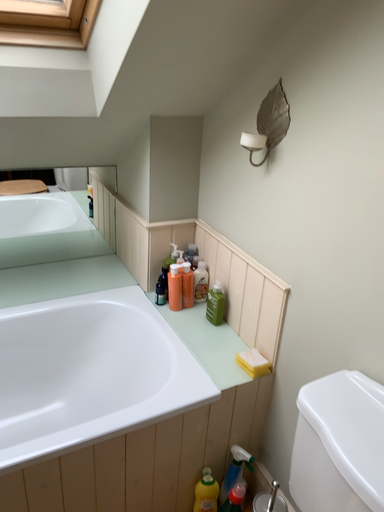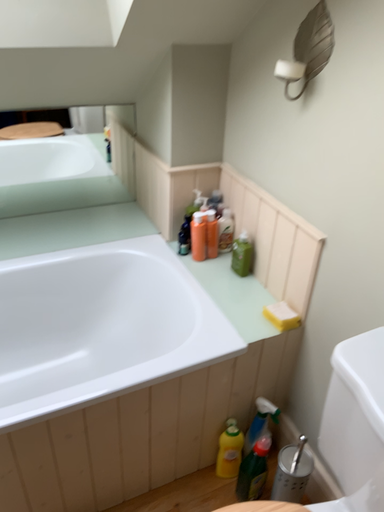
Question: How did the camera likely rotate when shooting the video?

Choices:
 (A) rotated upward
 (B) rotated downward

Answer: (B)